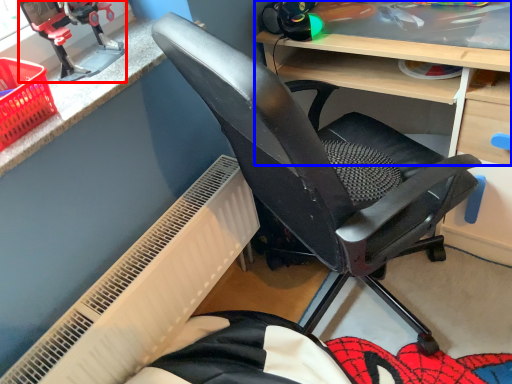
Question: Which object is further to the camera taking this photo, sport equipment (highlighted by a red box) or desk (highlighted by a blue box)?

Choices:
 (A) sport equipment
 (B) desk

Answer: (A)